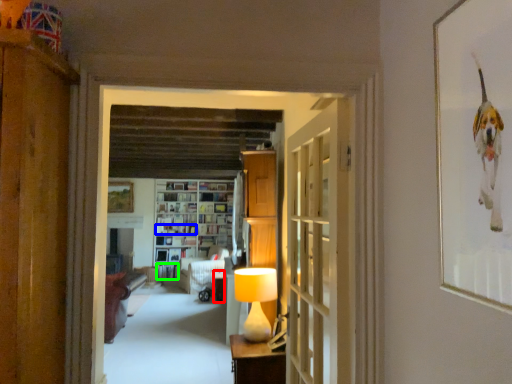
Question: Considering the real-world distances, which object is farthest from table (highlighted by a red box)? book (highlighted by a blue box) or book (highlighted by a green box)?

Choices:
 (A) book
 (B) book

Answer: (A)